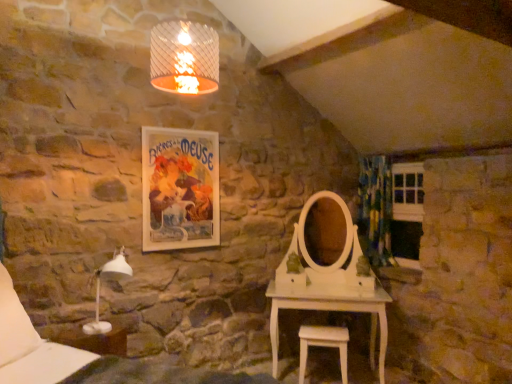
Image resolution: width=512 pixels, height=384 pixels. What do you see at coordinates (375, 208) in the screenshot?
I see `green floral fabric curtain at right` at bounding box center [375, 208].

Find the location of a particular element. green floral fabric curtain at right is located at coordinates (375, 208).

Where is `white wooden window at right`? white wooden window at right is located at coordinates (408, 211).

Locate an element on the screen. Image resolution: width=512 pixels, height=384 pixels. white soft pillow at lower left is located at coordinates (14, 324).

The image size is (512, 384). Describe the element at coordinates (180, 189) in the screenshot. I see `matte paper poster at upper center` at that location.

This screenshot has width=512, height=384. What are the coordinates of `green floral fabric curtain at right` in the screenshot? It's located at (x=375, y=208).

Is matte paper poster at upper center at the back of white soft pillow at lower left?

No, white soft pillow at lower left is not facing the opposite direction of matte paper poster at upper center.

Is point (6, 352) in front of point (166, 173)?

Yes, it is in front of point (166, 173).

Considering the sizes of white soft pillow at lower left and matte paper poster at upper center in the image, is white soft pillow at lower left taller or shorter than matte paper poster at upper center?

white soft pillow at lower left is shorter than matte paper poster at upper center.

Between white wood stool at lower center and white plastic table lamp at lower left, which one has larger size?

With larger size is white plastic table lamp at lower left.

Based on the photo, how distant is white wood stool at lower center from white plastic table lamp at lower left?

The distance of white wood stool at lower center from white plastic table lamp at lower left is 1.61 meters.

In the scene shown: Can you confirm if white wood stool at lower center is shorter than white plastic table lamp at lower left?

Yes, white wood stool at lower center is shorter than white plastic table lamp at lower left.

Between white wood stool at lower center and white plastic table lamp at lower left, which one has larger width?

white plastic table lamp at lower left.

From a real-world perspective, is matte paper poster at upper center on white wood stool at lower center?

Yes, from a real-world perspective, matte paper poster at upper center is over white wood stool at lower center

This screenshot has height=384, width=512. Find the location of `picture frame above the white wood stool at lower center (from a real-world perspective)`. picture frame above the white wood stool at lower center (from a real-world perspective) is located at coordinates (180, 189).

Considering the sizes of objects matte paper poster at upper center and white wood stool at lower center in the image provided, who is wider, matte paper poster at upper center or white wood stool at lower center?

white wood stool at lower center.

Is matte paper poster at upper center looking in the opposite direction of white wood stool at lower center?

No, matte paper poster at upper center is not facing the opposite direction of white wood stool at lower center.

Is white plastic table lamp at lower left wider than green floral fabric curtain at right?

Yes.

What's the angular difference between white plastic table lamp at lower left and green floral fabric curtain at right's facing directions?

The angle between the facing direction of white plastic table lamp at lower left and the facing direction of green floral fabric curtain at right is 86.7 degrees.

Considering the relative positions of white plastic table lamp at lower left and green floral fabric curtain at right in the image provided, is white plastic table lamp at lower left to the right of green floral fabric curtain at right from the viewer's perspective?

No, white plastic table lamp at lower left is not to the right of green floral fabric curtain at right.

Between white plastic table lamp at lower left and green floral fabric curtain at right, which one is positioned behind?

green floral fabric curtain at right is further away from the camera.

Are white wood stool at lower center and matte paper poster at upper center far apart?

white wood stool at lower center is positioned a significant distance from matte paper poster at upper center.

From their relative heights in the image, would you say white wood stool at lower center is taller or shorter than matte paper poster at upper center?

white wood stool at lower center is shorter than matte paper poster at upper center.

The height and width of the screenshot is (384, 512). I want to click on stool that is on the right side of matte paper poster at upper center, so tap(323, 345).

Can you confirm if white wood stool at lower center is thinner than matte paper poster at upper center?

No.

Do you think white wooden window at right is within green floral fabric curtain at right, or outside of it?

white wooden window at right cannot be found inside green floral fabric curtain at right.

Is the depth of white wooden window at right greater than that of green floral fabric curtain at right?

No, white wooden window at right is closer to the viewer.

Considering the relative positions of white wooden window at right and green floral fabric curtain at right in the image provided, is white wooden window at right to the right of green floral fabric curtain at right from the viewer's perspective?

Indeed, white wooden window at right is positioned on the right side of green floral fabric curtain at right.

From the image's perspective, is white wooden window at right above or below green floral fabric curtain at right?

white wooden window at right is situated lower than green floral fabric curtain at right in the image.

Measure the distance between white plastic table lamp at lower left and matte paper poster at upper center.

white plastic table lamp at lower left and matte paper poster at upper center are 66.31 centimeters apart.

Looking at this image, how many degrees apart are the facing directions of white plastic table lamp at lower left and matte paper poster at upper center?

There is a 2.78-degree angle between the facing directions of white plastic table lamp at lower left and matte paper poster at upper center.

Would you say white plastic table lamp at lower left is outside matte paper poster at upper center?

Yes, white plastic table lamp at lower left is located beyond the bounds of matte paper poster at upper center.

From the picture: Considering the sizes of white plastic table lamp at lower left and matte paper poster at upper center in the image, is white plastic table lamp at lower left wider or thinner than matte paper poster at upper center?

white plastic table lamp at lower left is wider than matte paper poster at upper center.

Find the location of `pillow located underneath the matte paper poster at upper center (from a real-world perspective)`. pillow located underneath the matte paper poster at upper center (from a real-world perspective) is located at coordinates coord(14,324).

Identify the location of stool located below the white plastic table lamp at lower left (from the image's perspective). The width and height of the screenshot is (512, 384). (323, 345).

Which object lies nearer to the anchor point white wood stool at lower center, white soft pillow at lower left or matte paper poster at upper center?

Among the two, matte paper poster at upper center is located nearer to white wood stool at lower center.

Estimate the real-world distances between objects in this image. Which object is closer to white plastic table lamp at lower left, green floral fabric curtain at right or white soft pillow at lower left?

white soft pillow at lower left is positioned closer to the anchor white plastic table lamp at lower left.

Based on their spatial positions, is green floral fabric curtain at right or white soft pillow at lower left further from matte paper poster at upper center?

green floral fabric curtain at right.

When comparing their distances from white wooden window at right, does white plastic table lamp at lower left or white wood stool at lower center seem further?

The object further to white wooden window at right is white plastic table lamp at lower left.

Based on their spatial positions, is white wood stool at lower center or white soft pillow at lower left further from white wooden window at right?

The object further to white wooden window at right is white soft pillow at lower left.

When comparing their distances from matte paper poster at upper center, does white wooden window at right or white wood stool at lower center seem further?

white wooden window at right.

When comparing their distances from white wooden window at right, does white plastic table lamp at lower left or matte paper poster at upper center seem further?

Based on the image, white plastic table lamp at lower left appears to be further to white wooden window at right.

From the image, which object appears to be farther from white wood stool at lower center, white soft pillow at lower left or white wooden window at right?

The object further to white wood stool at lower center is white soft pillow at lower left.

Locate an element on the screen. This screenshot has width=512, height=384. window that lies between green floral fabric curtain at right and white wood stool at lower center from top to bottom is located at coordinates (408, 211).

I want to click on table lamp situated between white soft pillow at lower left and green floral fabric curtain at right from left to right, so click(100, 287).

Locate an element on the screen. The height and width of the screenshot is (384, 512). picture frame between white soft pillow at lower left and white wooden window at right from left to right is located at coordinates (180, 189).

I want to click on table lamp between white soft pillow at lower left and white wood stool at lower center, so click(100, 287).